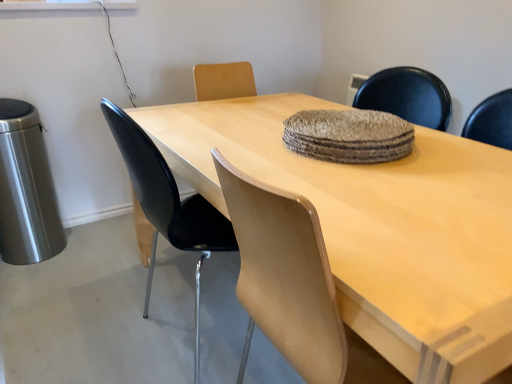
Question: From the image's perspective, is black plastic chair at left under textured woven mat at center?

Choices:
 (A) yes
 (B) no

Answer: (A)

Question: Are black plastic chair at left and textured woven mat at center far apart?

Choices:
 (A) yes
 (B) no

Answer: (B)

Question: From a real-world perspective, is black plastic chair at left physically below textured woven mat at center?

Choices:
 (A) yes
 (B) no

Answer: (A)

Question: From a real-world perspective, is black plastic chair at left physically above textured woven mat at center?

Choices:
 (A) no
 (B) yes

Answer: (A)

Question: Is black plastic chair at left shorter than textured woven mat at center?

Choices:
 (A) yes
 (B) no

Answer: (B)

Question: Is black plastic chair at left to the right of textured woven mat at center from the viewer's perspective?

Choices:
 (A) yes
 (B) no

Answer: (B)

Question: From the image's perspective, is light wood table at center located above textured woven mat at center?

Choices:
 (A) no
 (B) yes

Answer: (A)

Question: Is light wood table at center shorter than textured woven mat at center?

Choices:
 (A) yes
 (B) no

Answer: (B)

Question: Can you confirm if light wood table at center is taller than textured woven mat at center?

Choices:
 (A) yes
 (B) no

Answer: (A)

Question: Can you confirm if light wood table at center is thinner than textured woven mat at center?

Choices:
 (A) no
 (B) yes

Answer: (A)

Question: Is light wood table at center oriented towards textured woven mat at center?

Choices:
 (A) no
 (B) yes

Answer: (A)

Question: Can you confirm if light wood table at center is smaller than textured woven mat at center?

Choices:
 (A) yes
 (B) no

Answer: (B)

Question: Would you say black plastic chair at left is outside light wood table at center?

Choices:
 (A) yes
 (B) no

Answer: (B)